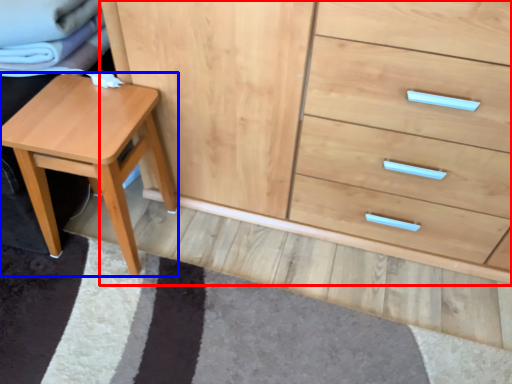
Question: Which point is further to the camera, chest of drawers (highlighted by a red box) or stool (highlighted by a blue box)?

Choices:
 (A) chest of drawers
 (B) stool

Answer: (B)